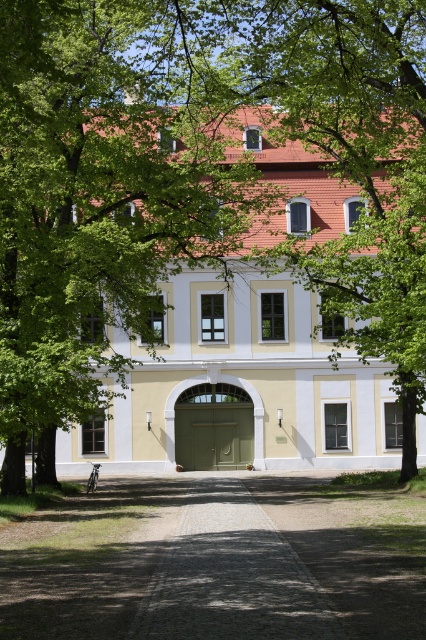
From the picture: Is gray cobblestone driveway at center wider than green matte/glossy door at center?

Yes, gray cobblestone driveway at center is wider than green matte/glossy door at center.

Is gray cobblestone driveway at center to the left of green matte/glossy door at center from the viewer's perspective?

No, gray cobblestone driveway at center is not to the left of green matte/glossy door at center.

The image size is (426, 640). I want to click on gray cobblestone driveway at center, so click(x=218, y=561).